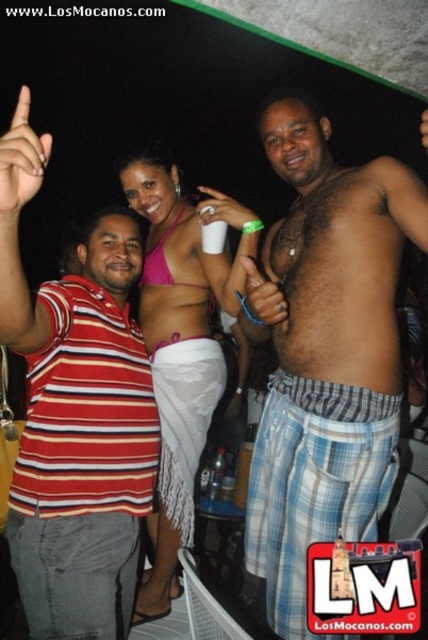
Based on the scene described, which object is taller between the smooth skin torso at center and the hairy skin at center?

The smooth skin torso at center is taller than the hairy skin at center.

You are a photographer at the party. You want to take a photo of the striped cotton shirt at left and the hairy skin at center. Which object should you zoom in more on to ensure both fit in the frame?

Since the striped cotton shirt at left is wider than the hairy skin at center, you should zoom in more on the striped cotton shirt at left to ensure both fit in the frame.